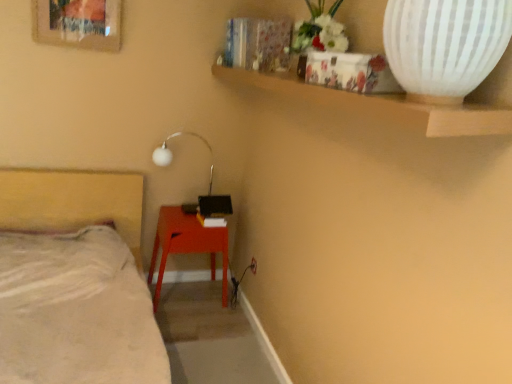
The image size is (512, 384). What are the coordinates of `vacant area situated below white glossy lamp at upper center (from a real-world perspective)` in the screenshot? It's located at (178, 209).